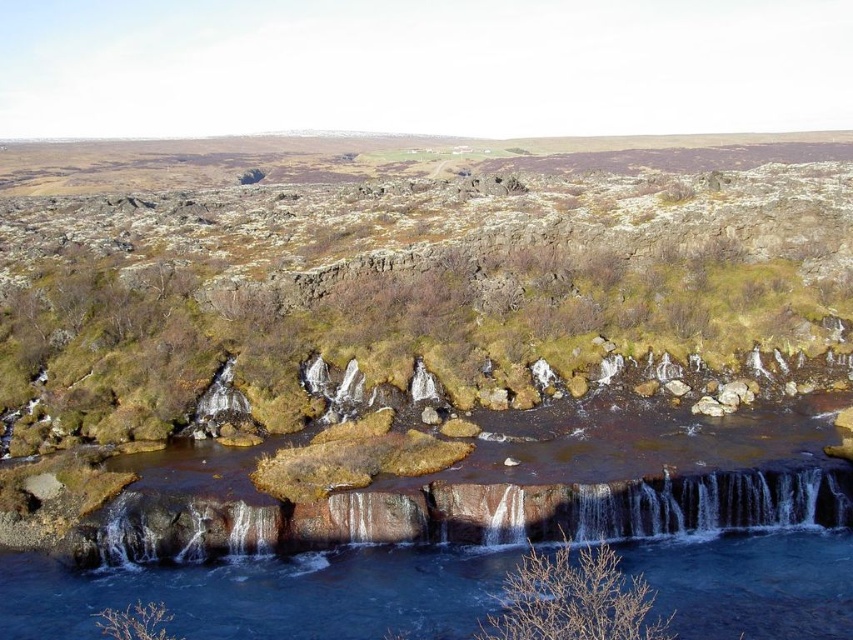
Which is behind, point (190, 320) or point (695, 492)?

The point (190, 320) is behind.

Between point (744, 269) and point (177, 467), which one is positioned behind?

The point (744, 269) is behind.

Where is `green mossy rock at center`? Image resolution: width=853 pixels, height=640 pixels. green mossy rock at center is located at coordinates (396, 333).

Between point (815, 362) and point (605, 572), which one is positioned in front?

Point (605, 572) is in front.

Is point (70, 339) behind point (556, 589)?

Yes, it is behind point (556, 589).

Where is `green mossy rock at center`? This screenshot has width=853, height=640. green mossy rock at center is located at coordinates (396, 333).

Where is `green mossy rock at center`? Image resolution: width=853 pixels, height=640 pixels. green mossy rock at center is located at coordinates (396, 333).

Which is below, brown rock river at center or smooth rock waterfall at center?

brown rock river at center

Who is more forward, (x=717, y=580) or (x=759, y=486)?

Point (x=717, y=580) is in front.

The image size is (853, 640). I want to click on brown rock river at center, so click(x=706, y=513).